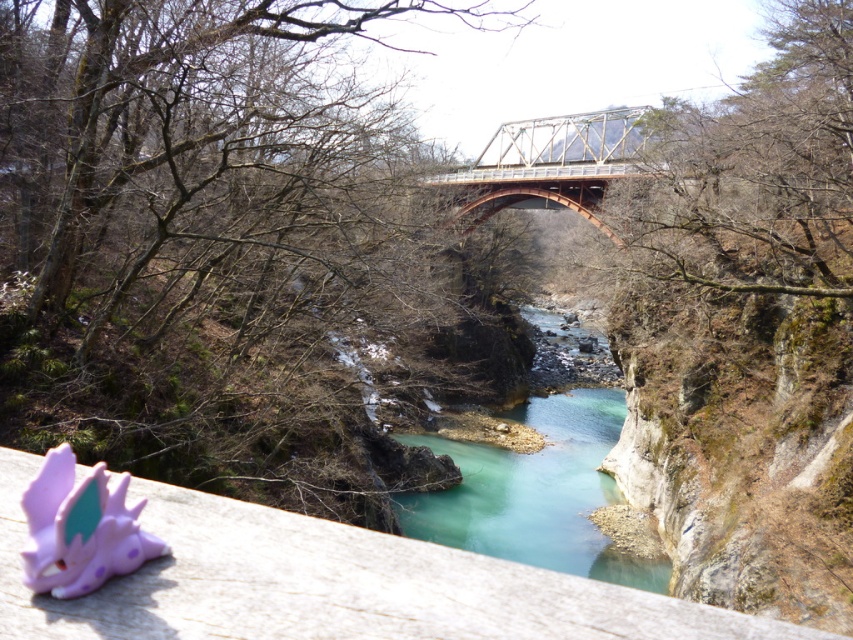
Question: Can you confirm if purple plastic toy at lower left is positioned to the right of metallic orange bridge at center?

Choices:
 (A) no
 (B) yes

Answer: (A)

Question: Is purple plastic toy at lower left smaller than turquoise smooth water at center?

Choices:
 (A) no
 (B) yes

Answer: (B)

Question: Which of the following is the closest to the observer?

Choices:
 (A) [650, 611]
 (B) [596, 136]
 (C) [486, 525]

Answer: (A)

Question: Which point is closer to the camera taking this photo?

Choices:
 (A) click(x=540, y=164)
 (B) click(x=189, y=600)

Answer: (B)

Question: Which object is closer to the camera taking this photo?

Choices:
 (A) turquoise smooth water at center
 (B) metallic orange bridge at center
 (C) purple plastic toy at lower left

Answer: (C)

Question: Does turquoise smooth water at center have a lesser width compared to metallic orange bridge at center?

Choices:
 (A) yes
 (B) no

Answer: (B)